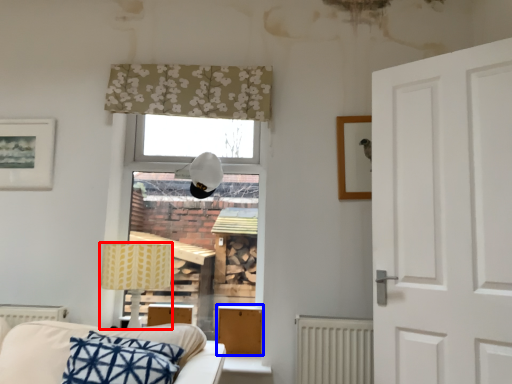
Question: Which of the following is the farthest to the observer, table lamp (highlighted by a red box) or furniture (highlighted by a blue box)?

Choices:
 (A) table lamp
 (B) furniture

Answer: (B)